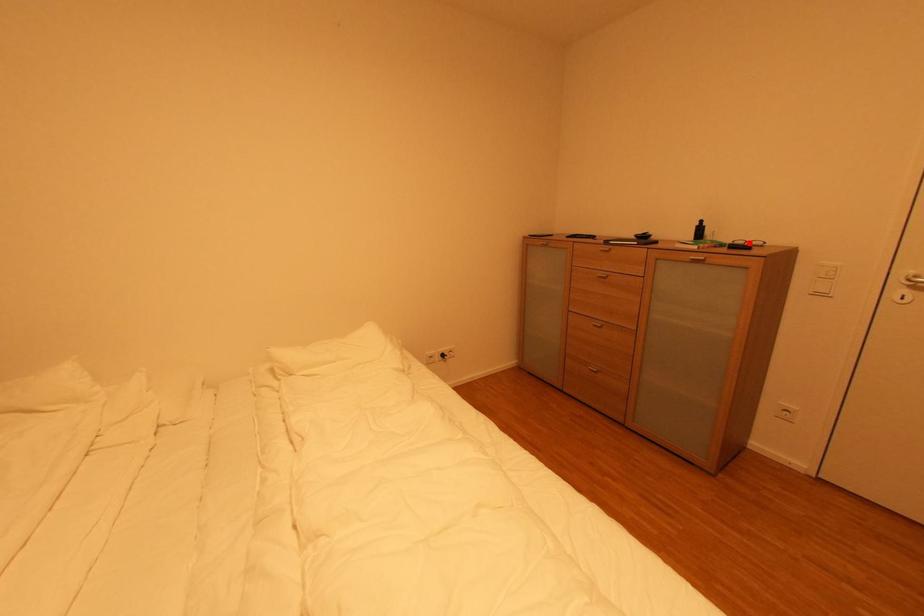
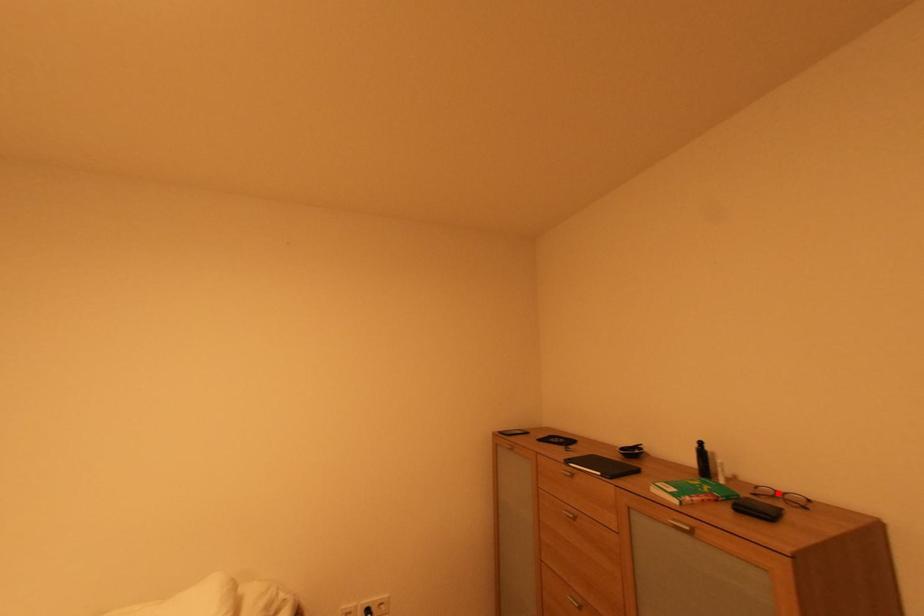
I am providing you with two images of the same scene from different viewpoints. A red point is marked on the first image and another point is marked on the second image. Are the points marked in image1 and image2 representing the same 3D position?

Yes